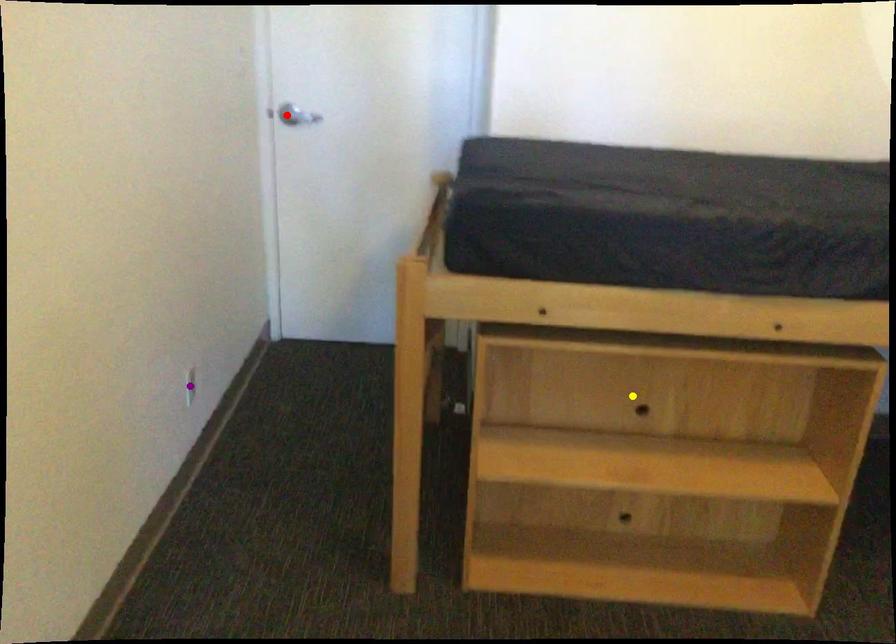
Order these from farthest to nearest:
A) purple point
B) red point
C) yellow point

red point, purple point, yellow point